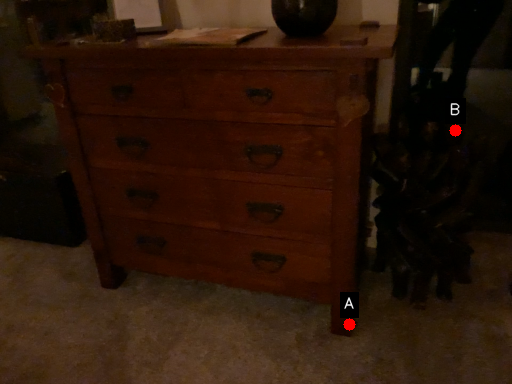
Question: Two points are circled on the image, labeled by A and B beside each circle. Which point is closer to the camera taking this photo?

Choices:
 (A) A is closer
 (B) B is closer

Answer: (A)